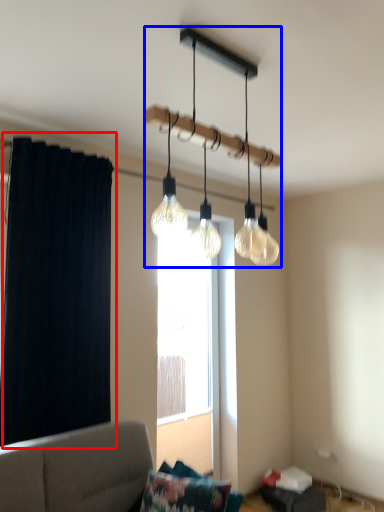
Question: Which of the following is the farthest to the observer, curtain (highlighted by a red box) or lamp (highlighted by a blue box)?

Choices:
 (A) curtain
 (B) lamp

Answer: (A)